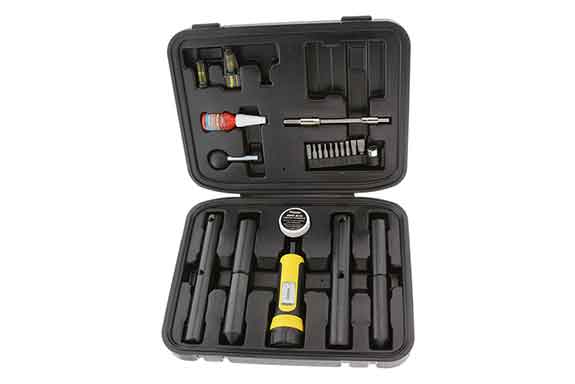
Where is `black handles`? The image size is (575, 384). black handles is located at coordinates (343, 320), (370, 318), (233, 314), (198, 314).